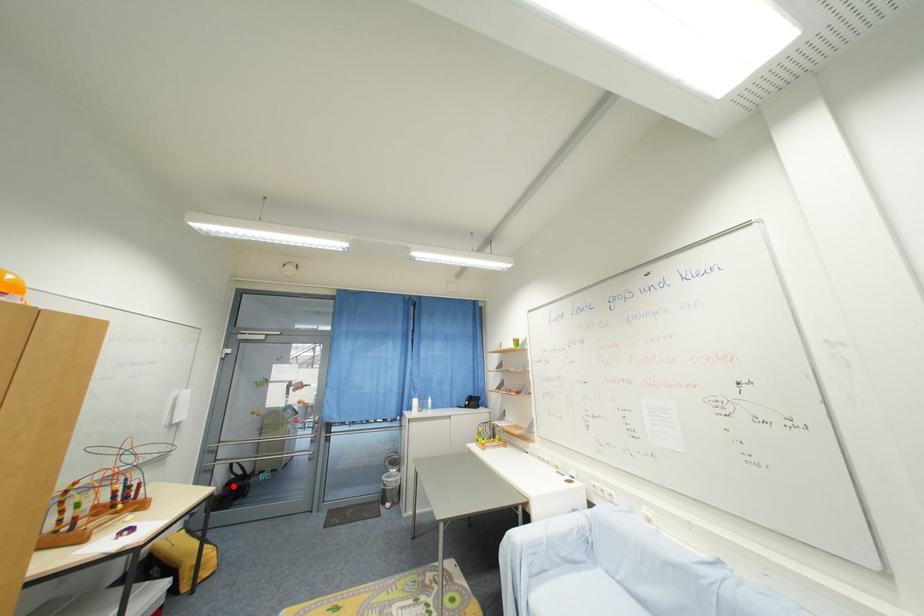
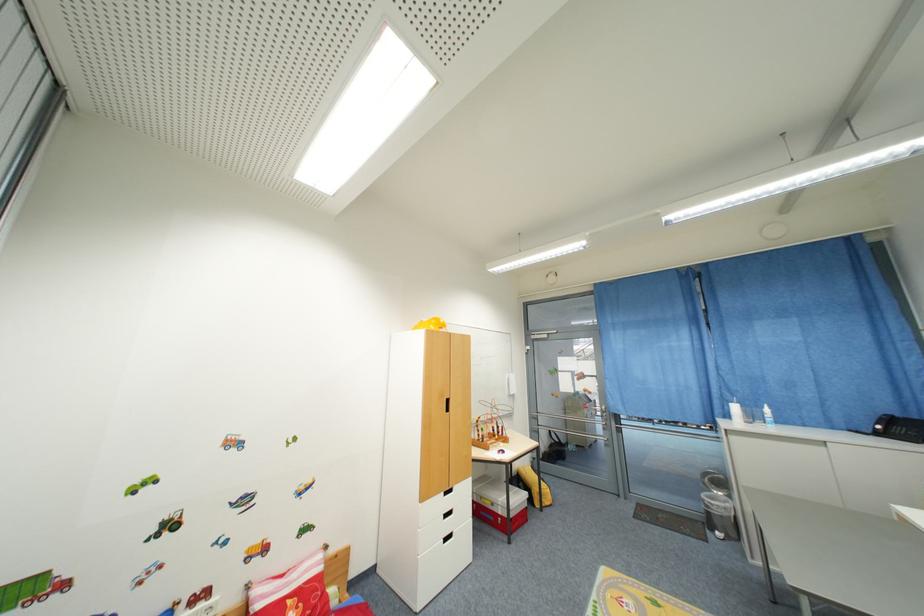
Question: A red point is marked in image1. In image2, is the corresponding 3D point closer to the camera or farther? Reply with the corresponding letter.

Choices:
 (A) The corresponding 3D point is closer.
 (B) The corresponding 3D point is farther.

Answer: (B)